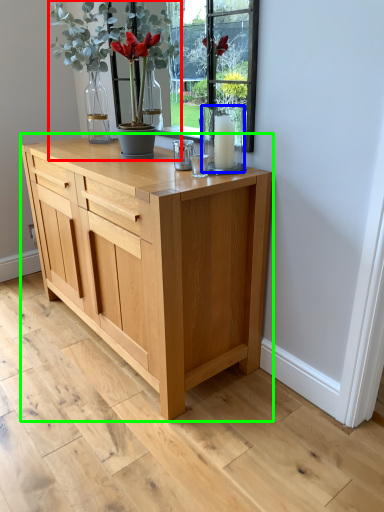
Question: Estimate the real-world distances between objects in this image. Which object is farther from houseplant (highlighted by a red box), glass vase (highlighted by a blue box) or chest of drawers (highlighted by a green box)?

Choices:
 (A) glass vase
 (B) chest of drawers

Answer: (B)